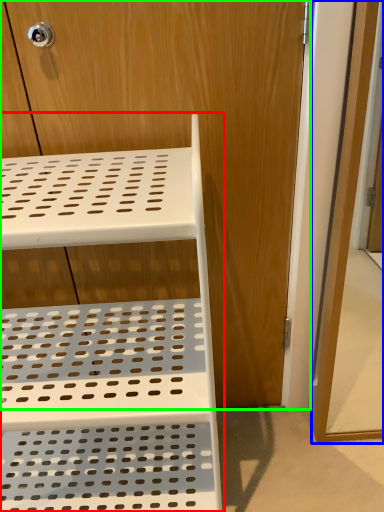
Question: Which object is positioned farthest from furniture (highlighted by a red box)? Select from screen door (highlighted by a blue box) and dresser (highlighted by a green box).

Choices:
 (A) screen door
 (B) dresser

Answer: (A)